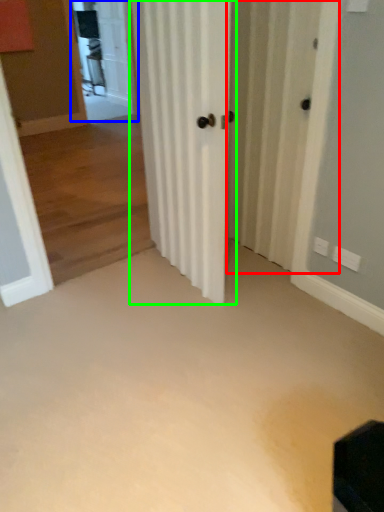
Question: Considering the real-world distances, which object is closest to screen door (highlighted by a red box)? screen door (highlighted by a blue box) or door (highlighted by a green box).

Choices:
 (A) screen door
 (B) door

Answer: (B)